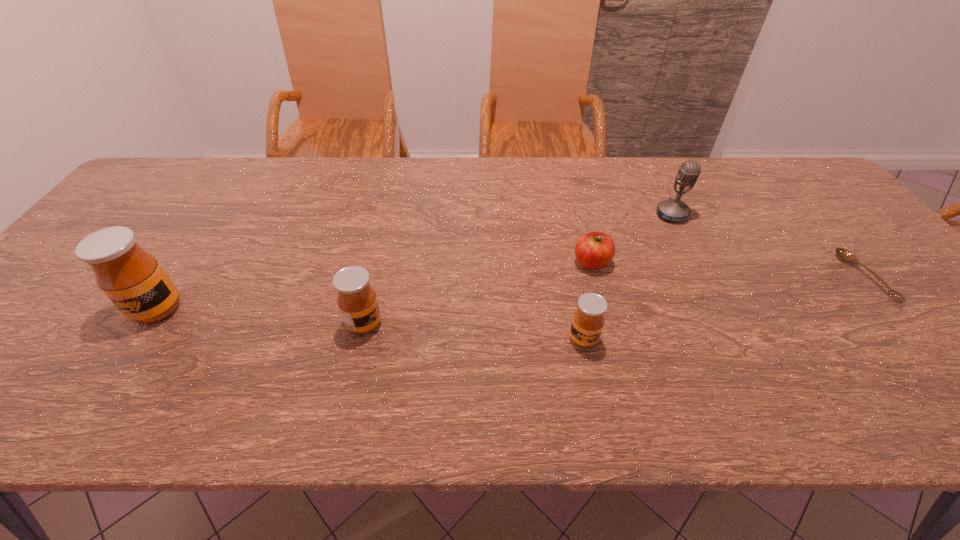
Locate an element on the screen. This screenshot has height=540, width=960. the farthest object is located at coordinates (674, 210).

Identify the location of vacant space located on the front-facing side of the tallest honey. The height and width of the screenshot is (540, 960). (130, 352).

At what (x,y) coordinates should I click in order to perform the action: click on vacant space located on the front-facing side of the second honey from right to left. Please return your answer as a coordinate pair (x, y). The height and width of the screenshot is (540, 960). Looking at the image, I should click on (440, 324).

The height and width of the screenshot is (540, 960). Find the location of `free region located on the front-facing side of the rightmost honey`. free region located on the front-facing side of the rightmost honey is located at coordinates (589, 372).

Where is `free space located on the left of the shortest object`? The image size is (960, 540). free space located on the left of the shortest object is located at coordinates (709, 277).

Where is `free location located on the back of the apple`? free location located on the back of the apple is located at coordinates (575, 197).

Find the location of a particular element. This screenshot has width=960, height=540. vacant space located on the front-facing side of the farthest object is located at coordinates (729, 330).

Identify the location of object located at the near edge. The width and height of the screenshot is (960, 540). (588, 320).

Where is `object present at the right edge`? This screenshot has height=540, width=960. object present at the right edge is located at coordinates (845, 255).

At what (x,y) coordinates should I click in order to perform the action: click on free space at the far edge. Please return your answer as a coordinate pair (x, y). The height and width of the screenshot is (540, 960). Looking at the image, I should click on (369, 158).